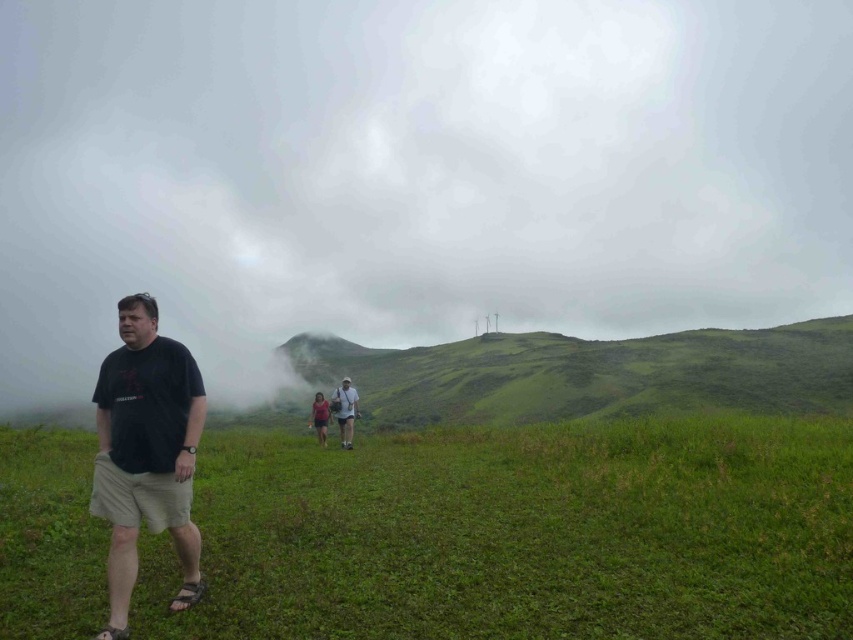
Question: Which point is farther to the camera?

Choices:
 (A) (320, 404)
 (B) (352, 396)
 (C) (817, 497)
 (D) (584, 237)

Answer: (D)

Question: Which object appears farthest from the camera in this image?

Choices:
 (A) black cotton shirt at left
 (B) white fluffy cloud at upper center
 (C) light brown shorts at center
 (D) green grassy field at lower left

Answer: (C)

Question: Can you confirm if light brown shorts at center is positioned to the left of pink fabric at center?

Choices:
 (A) no
 (B) yes

Answer: (A)

Question: Among these objects, which one is nearest to the camera?

Choices:
 (A) black cotton shirt at left
 (B) light brown shorts at center

Answer: (A)

Question: Observing the image, what is the correct spatial positioning of green grassy hillside at center in reference to black cotton shirt at left?

Choices:
 (A) above
 (B) below

Answer: (B)

Question: Does green grassy hillside at center have a lesser width compared to black cotton shirt at left?

Choices:
 (A) yes
 (B) no

Answer: (B)